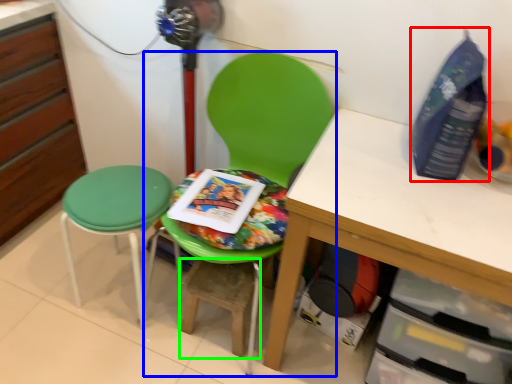
Question: Which is nearer to the bottle (highlighted by a red box)? chair (highlighted by a blue box) or step stool (highlighted by a green box).

Choices:
 (A) chair
 (B) step stool

Answer: (A)